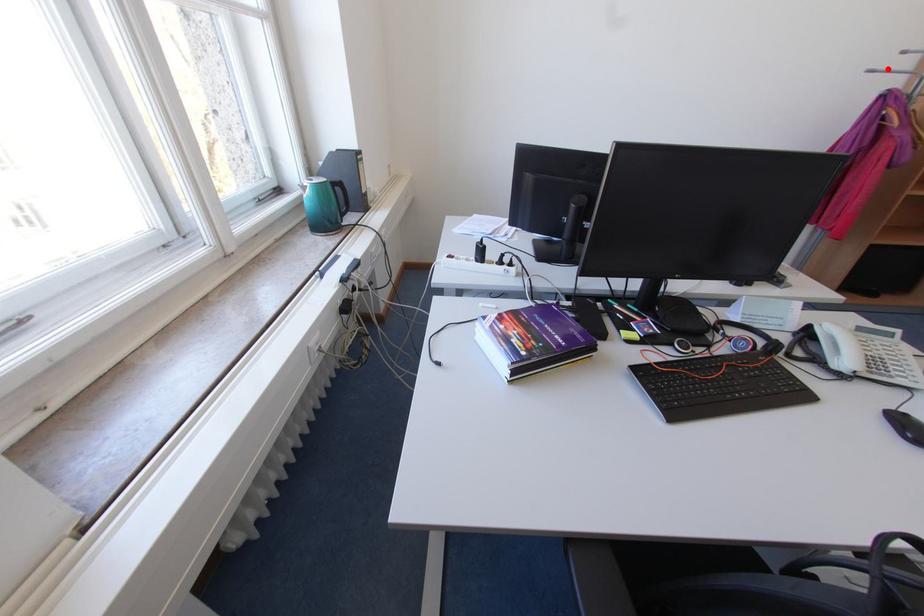
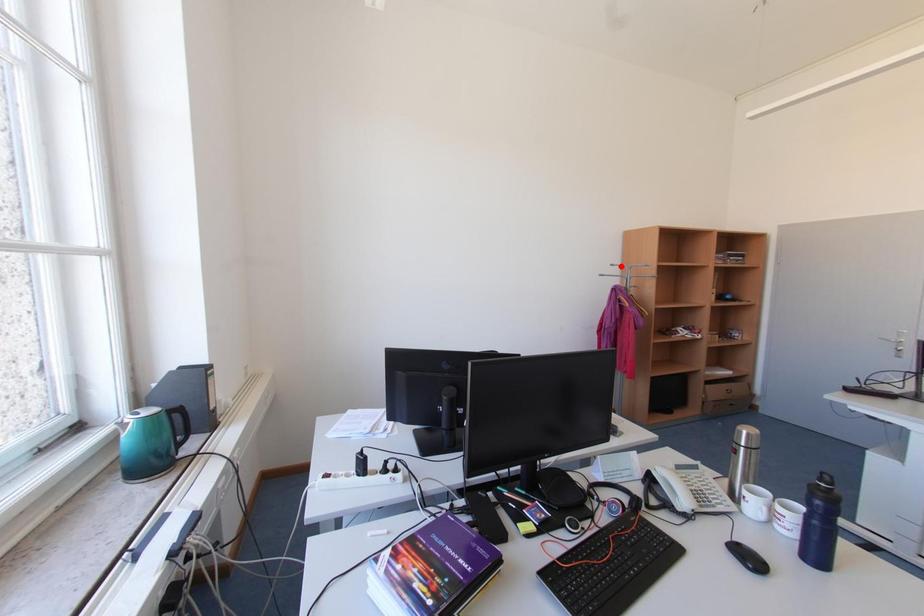
In the scene shown: I am providing you with two images of the same scene from different viewpoints. A red point is marked on the first image and another point is marked on the second image. Is the red point in image1 aligned with the point shown in image2?

No